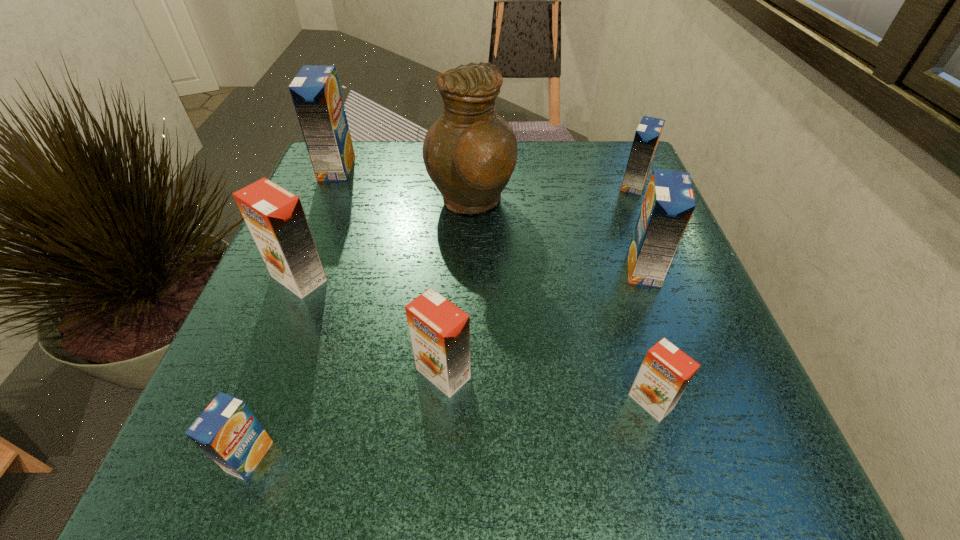
Locate an element on the screen. This screenshot has width=960, height=540. vacant space that satisfies the following two spatial constraints: 1. on the back side of the second biggest orange orange juice; 2. on the left side of the third biggest blue orange_juice is located at coordinates (456, 185).

At what (x,y) coordinates should I click in order to perform the action: click on free space that satisfies the following two spatial constraints: 1. at the spout of the tallest object; 2. on the front side of the farthest orange orange juice. Please return your answer as a coordinate pair (x, y). Looking at the image, I should click on (469, 278).

Where is `vacant space that satisfies the following two spatial constraints: 1. at the spout of the pitcher; 2. on the back side of the smallest orange orange juice`? The width and height of the screenshot is (960, 540). vacant space that satisfies the following two spatial constraints: 1. at the spout of the pitcher; 2. on the back side of the smallest orange orange juice is located at coordinates (466, 401).